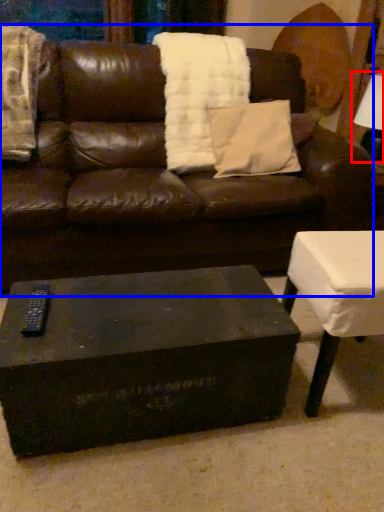
Question: Which of the following is the farthest to the observer, table lamp (highlighted by a red box) or studio couch (highlighted by a blue box)?

Choices:
 (A) table lamp
 (B) studio couch

Answer: (A)